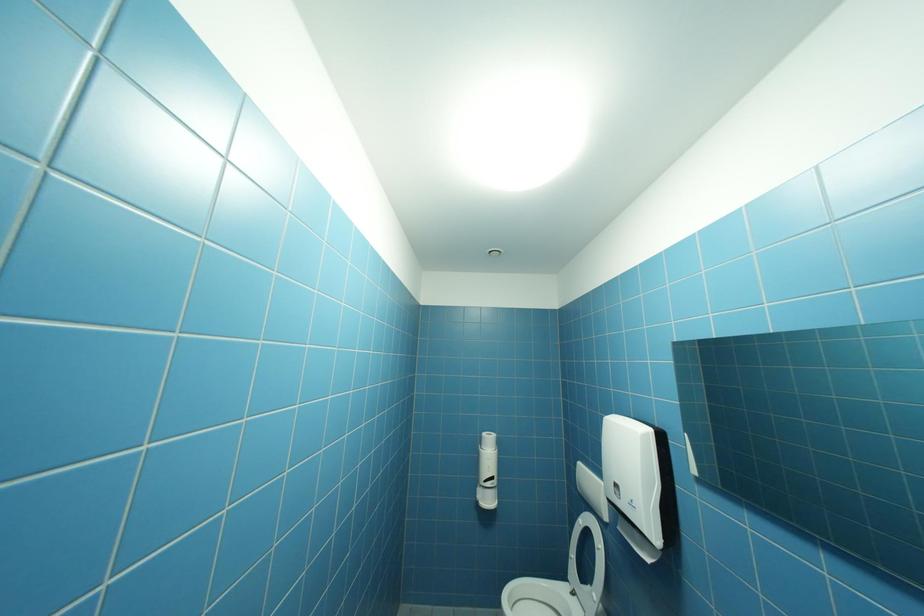
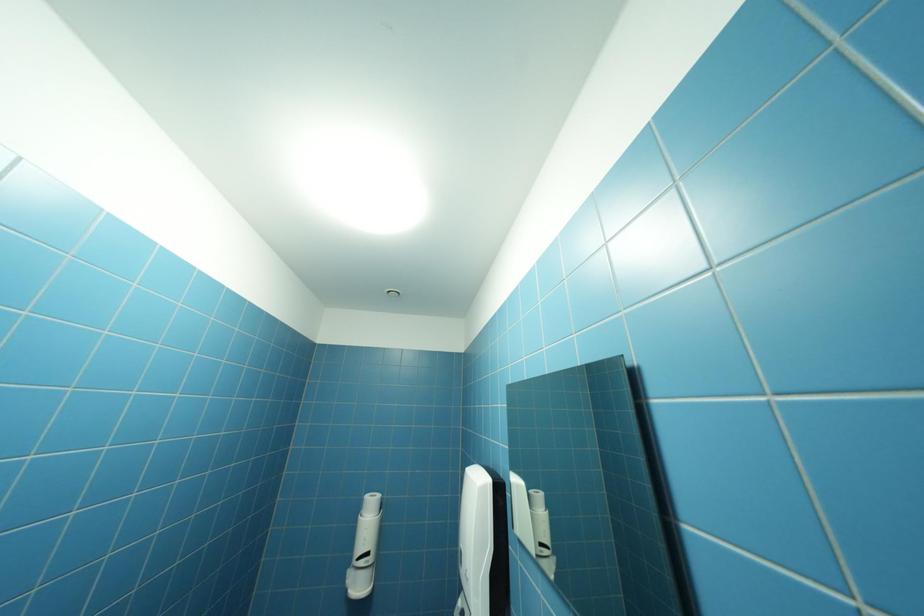
Question: How did the camera likely rotate?

Choices:
 (A) Left
 (B) Right
 (C) Up
 (D) Down

Answer: (C)